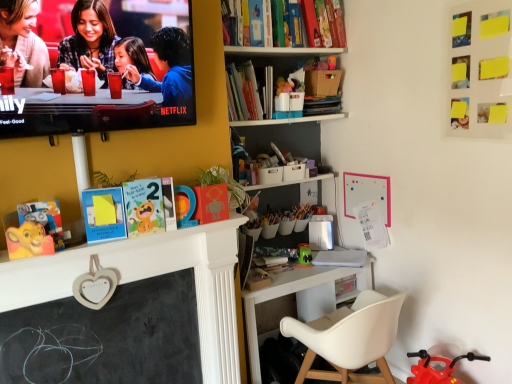
Question: Visually, is black chalkboard at center-left positioned to the left or to the right of matte black laptop at upper left?

Choices:
 (A) right
 (B) left

Answer: (B)

Question: Considering their positions, is black chalkboard at center-left located in front of or behind matte black laptop at upper left?

Choices:
 (A) behind
 (B) front

Answer: (A)

Question: Which of these objects is positioned closest to the matte black laptop at upper left?

Choices:
 (A) white plastic desk at center
 (B) white plastic chair at lower right
 (C) green matte toy at center
 (D) white paper at desk center, the 3th book from the top
 (E) black chalkboard at center-left

Answer: (E)

Question: Which object is positioned closest to the hardcover book at upper center, which ranks as the 1th book in top-to-bottom order?

Choices:
 (A) green matte toy at center
 (B) matte black laptop at upper left
 (C) white paper at desk center, the 1th book when ordered from bottom to top
 (D) white plastic desk at center
 (E) hardcover book at upper center, which appears as the 2th book when ordered from the bottom

Answer: (E)